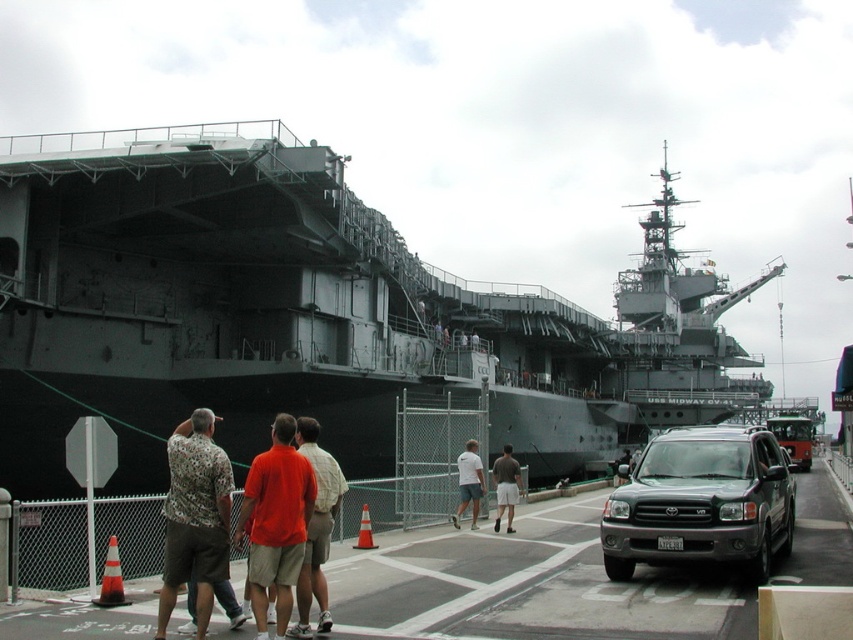
Question: Estimate the real-world distances between objects in this image. Which object is closer to the metallic gray suv at center?

Choices:
 (A) orange t-shirt at center
 (B) gray metallic ship at center
 (C) orange shirt at center
 (D) dark gray shirt at center

Answer: (C)

Question: Which point is closer to the camera?

Choices:
 (A) (740, 461)
 (B) (323, 561)
 (C) (473, 500)

Answer: (B)

Question: Which object is closer to the camera taking this photo?

Choices:
 (A) orange t-shirt at center
 (B) dark gray shirt at center
 (C) orange shirt at center

Answer: (A)

Question: Does orange shirt at center appear over dark gray shirt at center?

Choices:
 (A) yes
 (B) no

Answer: (A)

Question: Is orange shirt at center above white cotton shirt at center?

Choices:
 (A) no
 (B) yes

Answer: (B)

Question: Can you confirm if metallic gray suv at center is positioned below dark gray shirt at center?

Choices:
 (A) no
 (B) yes

Answer: (A)